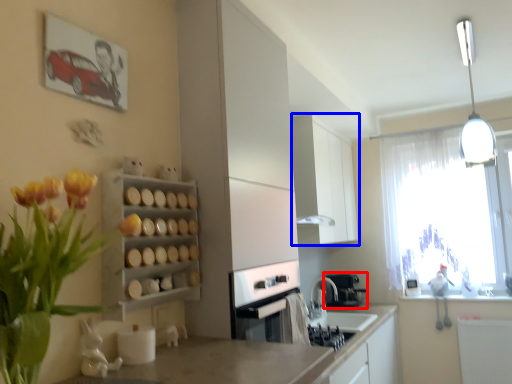
Question: Which object is further to the camera taking this photo, coffee machine (highlighted by a red box) or cabinetry (highlighted by a blue box)?

Choices:
 (A) coffee machine
 (B) cabinetry

Answer: (A)